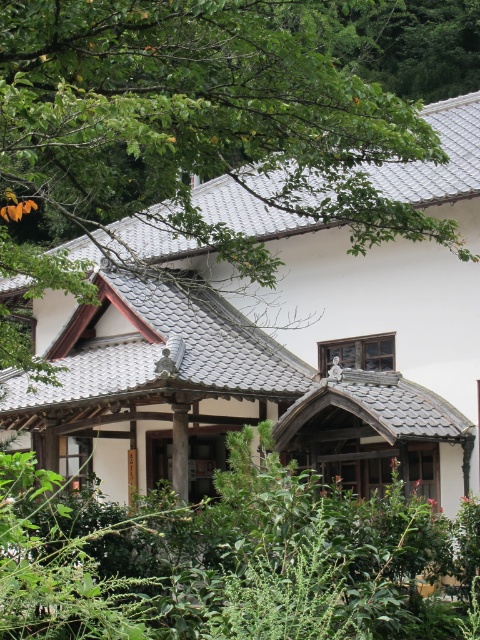
Question: Can you confirm if green leafy tree at upper left is positioned above green leafy bush at center?

Choices:
 (A) no
 (B) yes

Answer: (B)

Question: Which point appears closest to the camera in this image?

Choices:
 (A) (35, 163)
 (B) (299, 628)

Answer: (B)

Question: Is green leafy tree at upper left positioned in front of green leafy bush at center?

Choices:
 (A) no
 (B) yes

Answer: (A)

Question: Does green leafy tree at upper left appear on the left side of green leafy bush at center?

Choices:
 (A) no
 (B) yes

Answer: (B)

Question: Which object is closer to the camera taking this photo?

Choices:
 (A) green leafy bush at center
 (B) green leafy tree at upper left

Answer: (A)